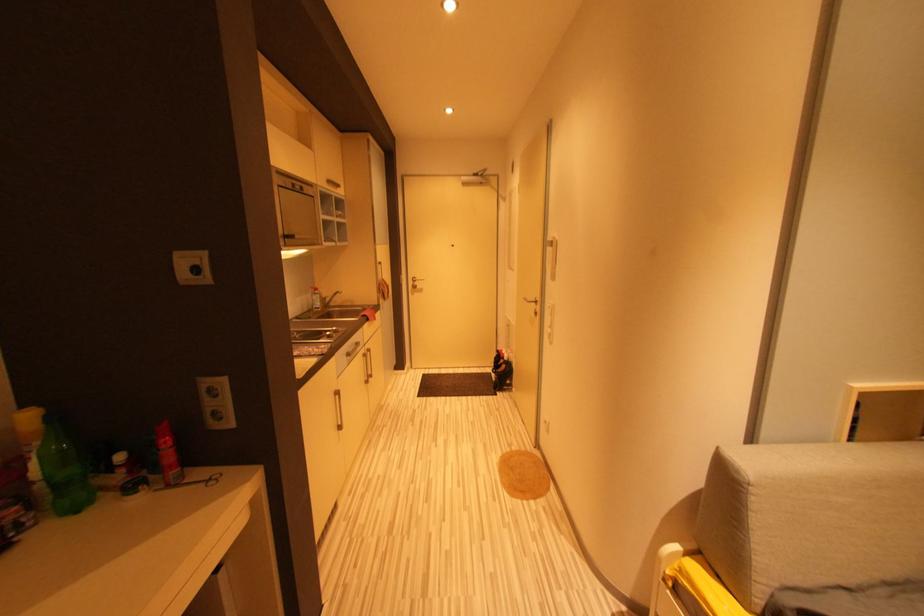
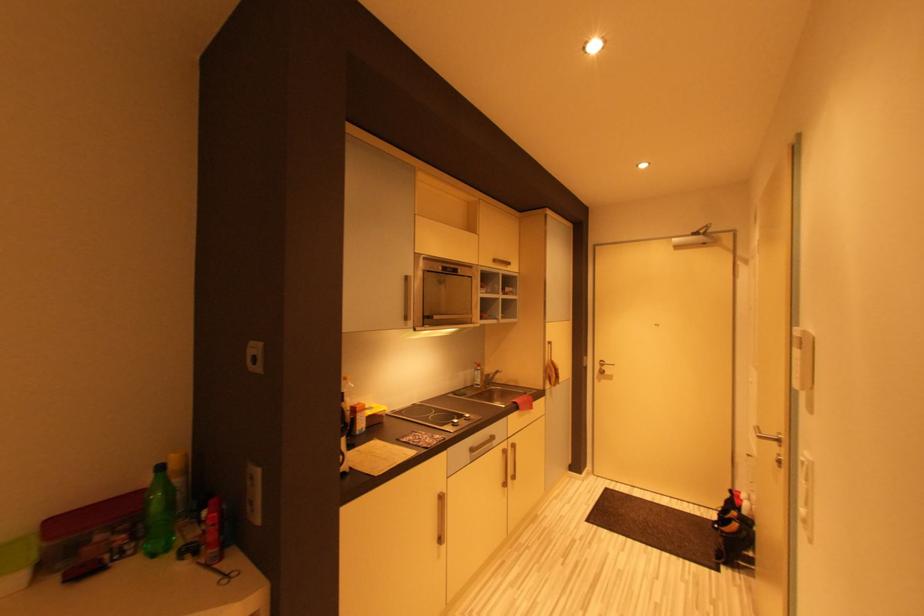
Question: The camera is either moving clockwise (left) or counter-clockwise (right) around the object. The first image is from the beginning of the video and the second image is from the end. Is the camera moving left or right when shooting the video?

Choices:
 (A) Left
 (B) Right

Answer: (B)